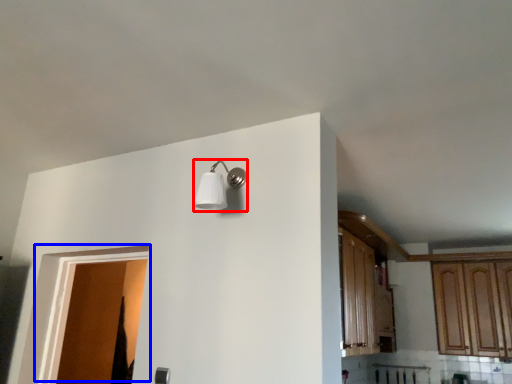
Question: Which point is closer to the camera, light fixture (highlighted by a red box) or door (highlighted by a blue box)?

Choices:
 (A) light fixture
 (B) door

Answer: (A)